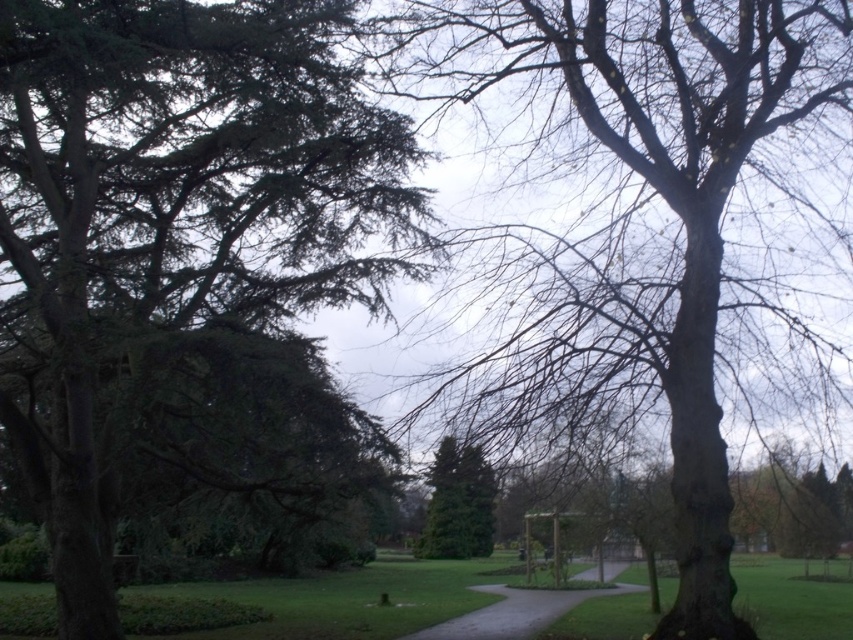
Can you confirm if smooth bark tree at center is positioned to the left of smooth asphalt path at center?

In fact, smooth bark tree at center is to the right of smooth asphalt path at center.

Measure the distance between smooth bark tree at center and camera.

42.06 feet

Find the location of a particular element. smooth bark tree at center is located at coordinates (648, 228).

Who is lower down, smooth bark tree at center or green textured tree at center?

green textured tree at center is below.

Who is positioned more to the right, smooth bark tree at center or green textured tree at center?

smooth bark tree at center

The image size is (853, 640). What do you see at coordinates (648, 228) in the screenshot? I see `smooth bark tree at center` at bounding box center [648, 228].

Image resolution: width=853 pixels, height=640 pixels. What are the coordinates of `smooth bark tree at center` in the screenshot? It's located at click(x=648, y=228).

Between point (469, 499) and point (550, 609), which one is positioned behind?

The point (469, 499) is behind.

Can you confirm if green textured tree at center is taller than smooth asphalt path at center?

Indeed, green textured tree at center has a greater height compared to smooth asphalt path at center.

Between point (473, 522) and point (625, 563), which one is positioned behind?

The point (473, 522) is behind.

The width and height of the screenshot is (853, 640). Find the location of `green textured tree at center`. green textured tree at center is located at coordinates (457, 502).